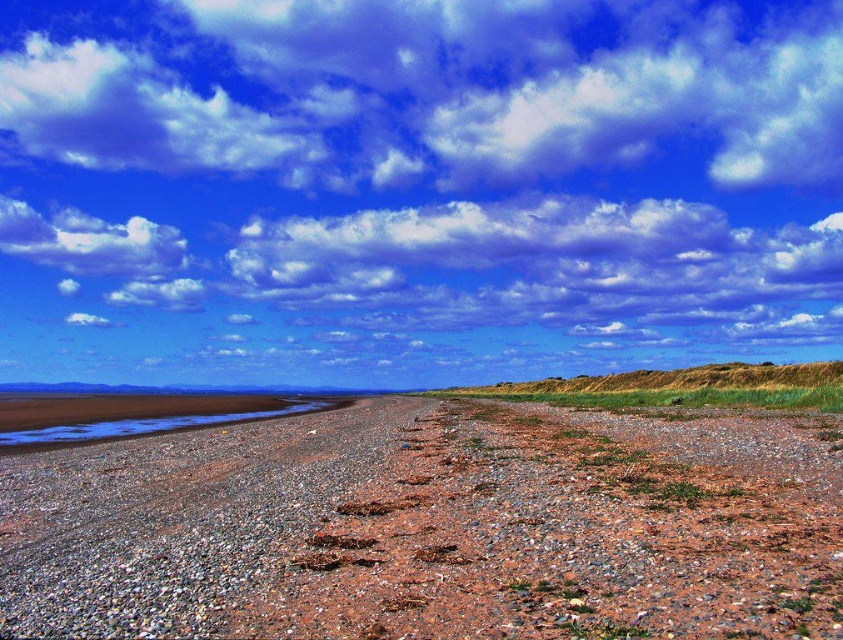
Question: Is the position of cloudy blue sky at upper center more distant than that of brown gravel at center?

Choices:
 (A) yes
 (B) no

Answer: (A)

Question: Does cloudy blue sky at upper center lie in front of brown gravel at center?

Choices:
 (A) yes
 (B) no

Answer: (B)

Question: Which point is farther to the camera?

Choices:
 (A) cloudy blue sky at upper center
 (B) brown gravel at center

Answer: (A)

Question: Is cloudy blue sky at upper center in front of brown gravel at center?

Choices:
 (A) no
 (B) yes

Answer: (A)

Question: Which object is closer to the camera taking this photo?

Choices:
 (A) brown gravel at center
 (B) cloudy blue sky at upper center

Answer: (A)